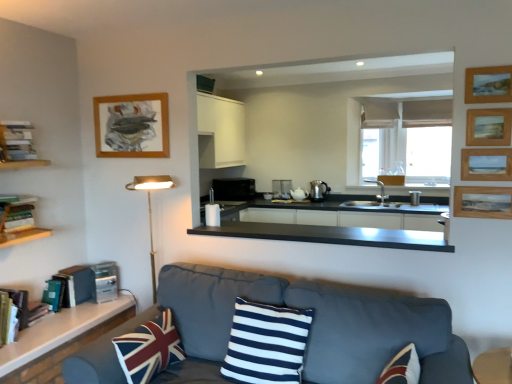
Question: Would you say white glossy countertop at lower left, the 2th countertop in the right-to-left sequence, contains satin silver toaster at lower left, the 3th appliance viewed from the top?

Choices:
 (A) yes
 (B) no

Answer: (B)

Question: Considering the relative sizes of white glossy countertop at lower left, which appears as the 2th countertop when viewed from the top, and satin silver toaster at lower left, the third appliance in the right-to-left sequence, in the image provided, is white glossy countertop at lower left, which appears as the 2th countertop when viewed from the top, bigger than satin silver toaster at lower left, the third appliance in the right-to-left sequence,?

Choices:
 (A) no
 (B) yes

Answer: (B)

Question: Is white glossy countertop at lower left, arranged as the first countertop when ordered from the bottom, facing away from satin silver toaster at lower left, the 3th appliance viewed from the top?

Choices:
 (A) no
 (B) yes

Answer: (A)

Question: Considering the relative sizes of white glossy countertop at lower left, the 2th countertop in the right-to-left sequence, and satin silver toaster at lower left, which is the first appliance from bottom to top, in the image provided, is white glossy countertop at lower left, the 2th countertop in the right-to-left sequence, taller than satin silver toaster at lower left, which is the first appliance from bottom to top,?

Choices:
 (A) yes
 (B) no

Answer: (B)

Question: Does white glossy countertop at lower left, which appears as the 2th countertop when viewed from the top, touch satin silver toaster at lower left, the 3th appliance in the back-to-front sequence?

Choices:
 (A) no
 (B) yes

Answer: (A)

Question: Is white glossy countertop at lower left, which appears as the 2th countertop when viewed from the top, far away from satin silver toaster at lower left, which is the first appliance from bottom to top?

Choices:
 (A) no
 (B) yes

Answer: (A)

Question: Is wooden bookshelf at left a part of navy blue and white striped cushion at center, the first pillow positioned from the right?

Choices:
 (A) yes
 (B) no

Answer: (B)

Question: From the image's perspective, is navy blue and white striped cushion at center, positioned as the second pillow in left-to-right order, over wooden bookshelf at left?

Choices:
 (A) no
 (B) yes

Answer: (A)

Question: Is navy blue and white striped cushion at center, positioned as the second pillow in left-to-right order, next to wooden bookshelf at left and touching it?

Choices:
 (A) no
 (B) yes

Answer: (A)

Question: Is navy blue and white striped cushion at center, positioned as the second pillow in left-to-right order, located outside wooden bookshelf at left?

Choices:
 (A) no
 (B) yes

Answer: (B)

Question: From a real-world perspective, is navy blue and white striped cushion at center, positioned as the second pillow in left-to-right order, positioned under wooden bookshelf at left based on gravity?

Choices:
 (A) yes
 (B) no

Answer: (A)

Question: Does navy blue and white striped cushion at center, the first pillow positioned from the right, turn towards wooden bookshelf at left?

Choices:
 (A) yes
 (B) no

Answer: (B)

Question: Does white glossy countertop at lower left, which is counted as the first countertop, starting from the left, have a lesser height compared to wooden textured picture frame at right, the fourth picture frame positioned from the front?

Choices:
 (A) yes
 (B) no

Answer: (A)